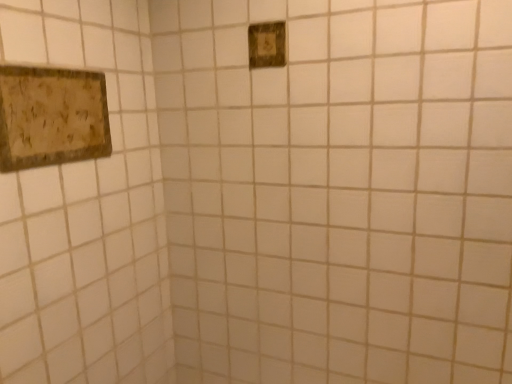
Question: Does green textured switch at upper center turn towards wooden textured picture frame at upper left?

Choices:
 (A) no
 (B) yes

Answer: (A)

Question: Can you confirm if green textured switch at upper center is smaller than wooden textured picture frame at upper left?

Choices:
 (A) yes
 (B) no

Answer: (A)

Question: Does green textured switch at upper center come behind wooden textured picture frame at upper left?

Choices:
 (A) yes
 (B) no

Answer: (A)

Question: Is green textured switch at upper center with wooden textured picture frame at upper left?

Choices:
 (A) no
 (B) yes

Answer: (A)

Question: Does green textured switch at upper center appear on the right side of wooden textured picture frame at upper left?

Choices:
 (A) no
 (B) yes

Answer: (B)

Question: Considering the relative sizes of green textured switch at upper center and wooden textured picture frame at upper left in the image provided, is green textured switch at upper center bigger than wooden textured picture frame at upper left?

Choices:
 (A) no
 (B) yes

Answer: (A)

Question: Can you confirm if wooden textured picture frame at upper left is bigger than green textured switch at upper center?

Choices:
 (A) yes
 (B) no

Answer: (A)

Question: Is wooden textured picture frame at upper left positioned behind green textured switch at upper center?

Choices:
 (A) yes
 (B) no

Answer: (B)

Question: Does wooden textured picture frame at upper left have a greater width compared to green textured switch at upper center?

Choices:
 (A) no
 (B) yes

Answer: (B)

Question: Is wooden textured picture frame at upper left thinner than green textured switch at upper center?

Choices:
 (A) no
 (B) yes

Answer: (A)

Question: Considering the relative sizes of wooden textured picture frame at upper left and green textured switch at upper center in the image provided, is wooden textured picture frame at upper left smaller than green textured switch at upper center?

Choices:
 (A) yes
 (B) no

Answer: (B)

Question: From the image's perspective, is wooden textured picture frame at upper left located beneath green textured switch at upper center?

Choices:
 (A) yes
 (B) no

Answer: (A)

Question: Looking at their shapes, would you say wooden textured picture frame at upper left is wider or thinner than green textured switch at upper center?

Choices:
 (A) wide
 (B) thin

Answer: (A)